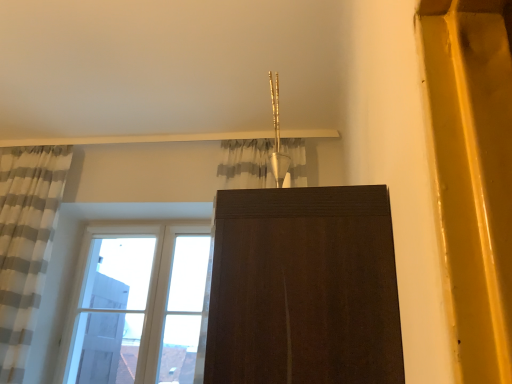
Image resolution: width=512 pixels, height=384 pixels. What do you see at coordinates (26, 243) in the screenshot?
I see `white striped fabric at left` at bounding box center [26, 243].

What is the approximate height of white striped fabric at left?

white striped fabric at left is 1.50 meters in height.

At what (x,y) coordinates should I click in order to perform the action: click on white striped fabric at left. Please return your answer as a coordinate pair (x, y). This screenshot has width=512, height=384. Looking at the image, I should click on (26, 243).

What do you see at coordinates (136, 304) in the screenshot?
I see `clear glass window at lower left` at bounding box center [136, 304].

What is the approximate height of clear glass window at lower left?

clear glass window at lower left is 3.72 feet in height.

You are a GUI agent. You are given a task and a screenshot of the screen. Output one action in this format:
    pyautogui.click(x=<x>, y=<y>)
    Task: Click on the clear glass window at lower left
    
    Given the screenshot: What is the action you would take?
    pyautogui.click(x=136, y=304)

What are the coordinates of `white striped fabric at left` in the screenshot? It's located at (26, 243).

In the scene shown: Between clear glass window at lower left and white striped fabric at left, which one appears on the left side from the viewer's perspective?

From the viewer's perspective, white striped fabric at left appears more on the left side.

Is the position of clear glass window at lower left less distant than that of white striped fabric at left?

No, it is not.

Which is less distant, (173,271) or (5,369)?

Point (173,271) appears to be farther away from the viewer than point (5,369).

From the image's perspective, does clear glass window at lower left appear higher than white striped fabric at left?

No, from the image's perspective, clear glass window at lower left is not on top of white striped fabric at left.

From a real-world perspective, does clear glass window at lower left stand above white striped fabric at left?

No, from a real-world perspective, clear glass window at lower left is not over white striped fabric at left

In terms of width, does clear glass window at lower left look wider or thinner when compared to white striped fabric at left?

Clearly, clear glass window at lower left has less width compared to white striped fabric at left.

Between clear glass window at lower left and white striped fabric at left, which one has more height?

white striped fabric at left.

Considering the relative sizes of clear glass window at lower left and white striped fabric at left in the image provided, is clear glass window at lower left bigger than white striped fabric at left?

Incorrect, clear glass window at lower left is not larger than white striped fabric at left.

Looking at this image, is clear glass window at lower left completely or partially outside of white striped fabric at left?

Indeed, clear glass window at lower left is completely outside white striped fabric at left.

Is clear glass window at lower left placed right next to white striped fabric at left?

No, clear glass window at lower left is not with white striped fabric at left.

Is clear glass window at lower left aimed at white striped fabric at left?

Yes, clear glass window at lower left is oriented towards white striped fabric at left.

What's the angular difference between clear glass window at lower left and white striped fabric at left's facing directions?

They differ by 0.201 degrees in their facing directions.

This screenshot has height=384, width=512. I want to click on window below the white striped fabric at left (from the image's perspective), so click(136, 304).

Is white striped fabric at left to the left of clear glass window at lower left from the viewer's perspective?

Correct, you'll find white striped fabric at left to the left of clear glass window at lower left.

Which object is further away from the camera, white striped fabric at left or clear glass window at lower left?

Positioned behind is clear glass window at lower left.

Is point (54, 210) positioned after point (149, 317)?

No, (54, 210) is in front of (149, 317).

From the image's perspective, is white striped fabric at left above or below clear glass window at lower left?

Clearly, from the image's perspective, white striped fabric at left is above clear glass window at lower left.

From a real-world perspective, is white striped fabric at left physically below clear glass window at lower left?

Incorrect, from a real-world perspective, white striped fabric at left is higher than clear glass window at lower left.

Does white striped fabric at left have a greater width compared to clear glass window at lower left?

Indeed, white striped fabric at left has a greater width compared to clear glass window at lower left.

Is white striped fabric at left shorter than clear glass window at lower left?

No, white striped fabric at left is not shorter than clear glass window at lower left.

Is white striped fabric at left bigger than clear glass window at lower left?

Yes.

Is white striped fabric at left outside of clear glass window at lower left?

white striped fabric at left lies outside clear glass window at lower left's area.

Can you see white striped fabric at left touching clear glass window at lower left?

white striped fabric at left is not next to clear glass window at lower left, and they're not touching.

Is white striped fabric at left oriented away from clear glass window at lower left?

No, white striped fabric at left is not facing the opposite direction of clear glass window at lower left.

Locate an element on the screen. This screenshot has width=512, height=384. curtain on the left of clear glass window at lower left is located at coordinates (26, 243).

Find the location of `curtain above the clear glass window at lower left (from the image's perspective)`. curtain above the clear glass window at lower left (from the image's perspective) is located at coordinates (26, 243).

In the image, there is a white striped fabric at left. In order to click on window below it (from the image's perspective) in this screenshot , I will do `click(136, 304)`.